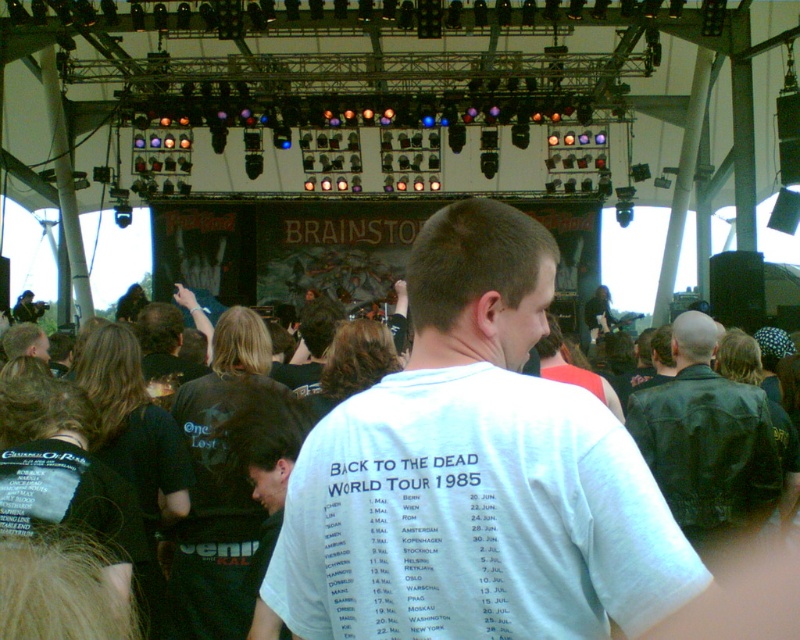
Question: Is white cotton t-shirt at center behind dark brown leather jacket at center?

Choices:
 (A) no
 (B) yes

Answer: (A)

Question: Considering the real-world distances, which object is farthest from the white cotton t-shirt at center?

Choices:
 (A) black leather jacket at right
 (B) dark brown leather jacket at center

Answer: (B)

Question: Which object is the farthest from the black leather jacket at right?

Choices:
 (A) dark brown leather jacket at center
 (B) white cotton t-shirt at center

Answer: (A)

Question: Among these objects, which one is nearest to the camera?

Choices:
 (A) dark brown leather jacket at center
 (B) black leather jacket at right
 (C) white cotton t-shirt at center

Answer: (C)

Question: Does white cotton t-shirt at center have a greater width compared to black leather jacket at right?

Choices:
 (A) no
 (B) yes

Answer: (B)

Question: From the image, what is the correct spatial relationship of white cotton t-shirt at center in relation to black leather jacket at right?

Choices:
 (A) above
 (B) below

Answer: (A)